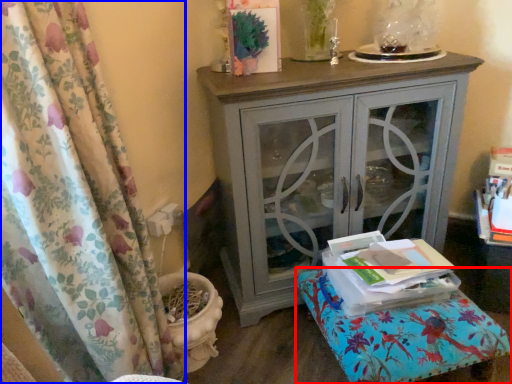
Question: Which object appears farthest to the camera in this image, furniture (highlighted by a red box) or curtain (highlighted by a blue box)?

Choices:
 (A) furniture
 (B) curtain

Answer: (A)